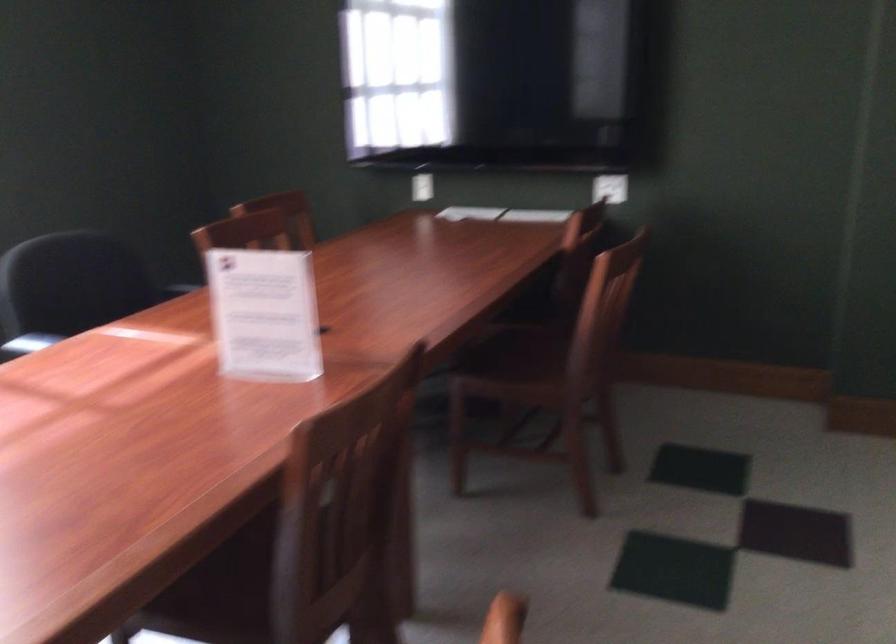
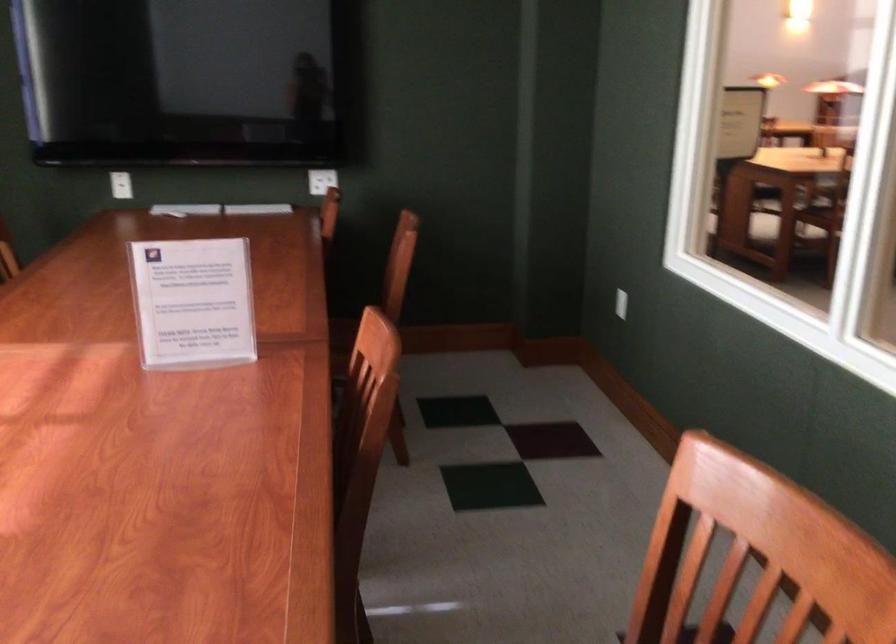
Where in the second image is the point corresponding to pixel 254 313 from the first image?

(193, 303)